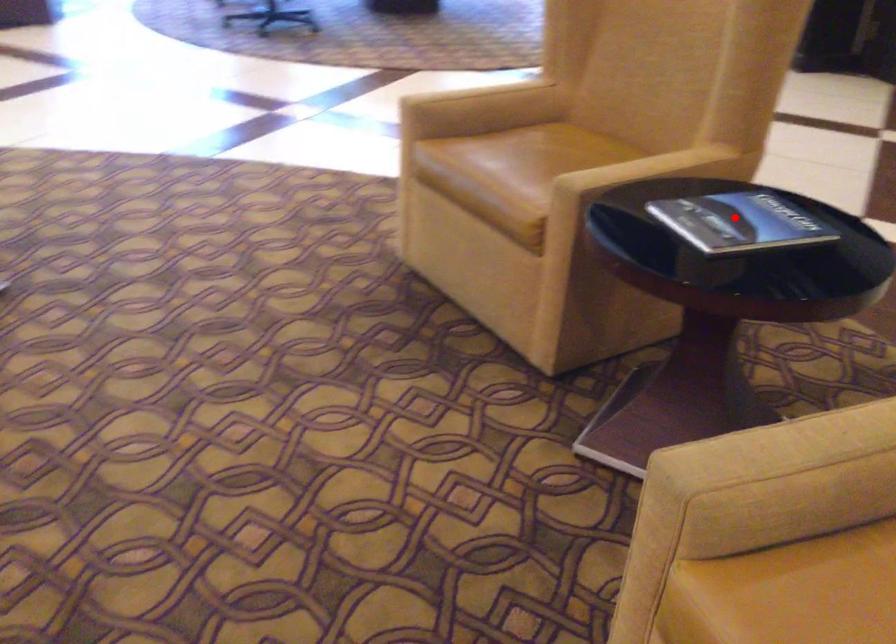
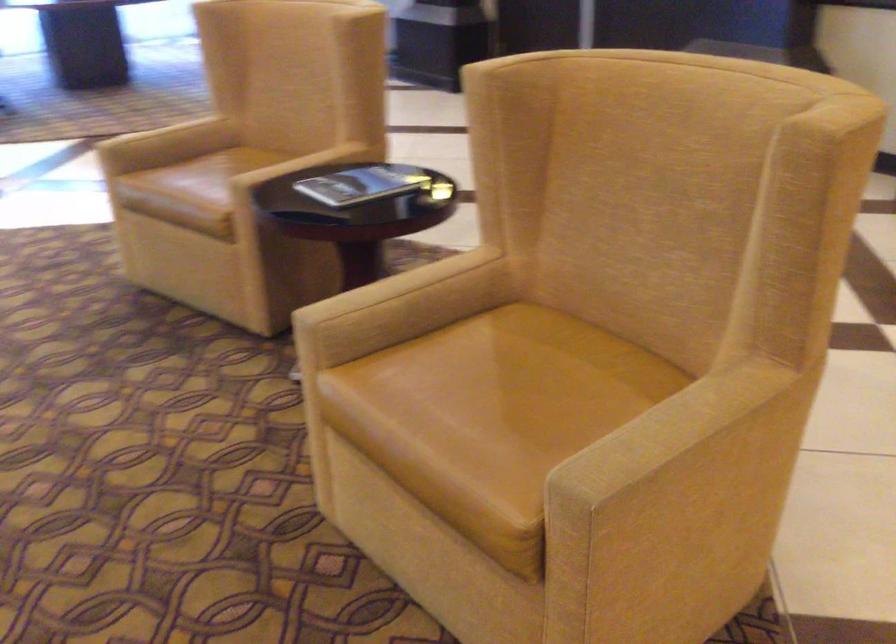
Locate, in the second image, the point that corresponds to the highlighted location in the first image.

(363, 184)